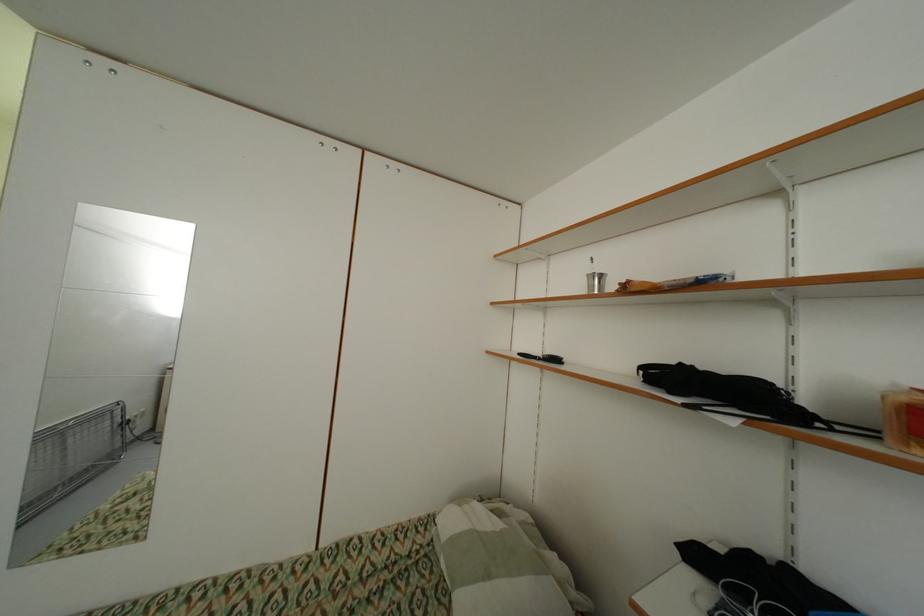
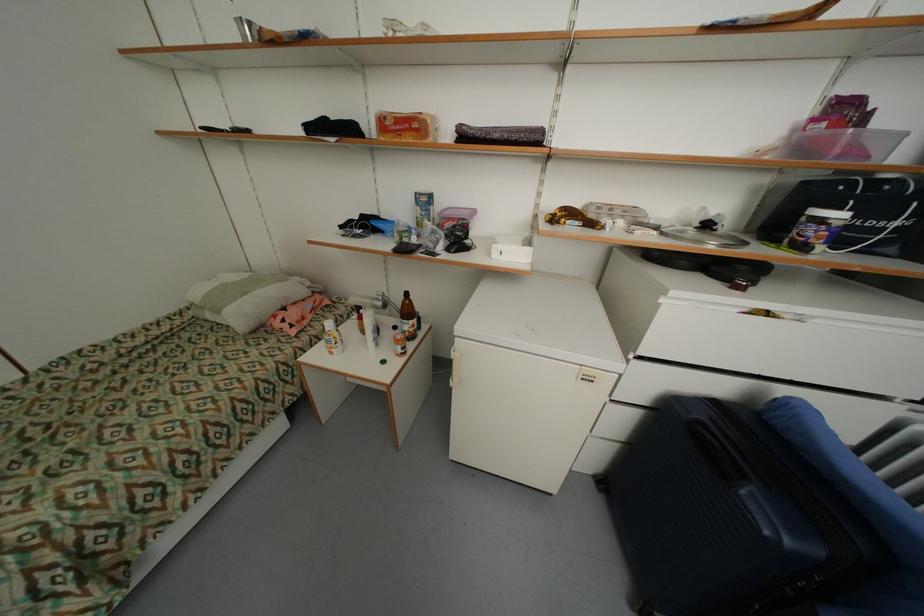
The point at (556, 352) is marked in the first image. Where is the corresponding point in the second image?

(248, 128)